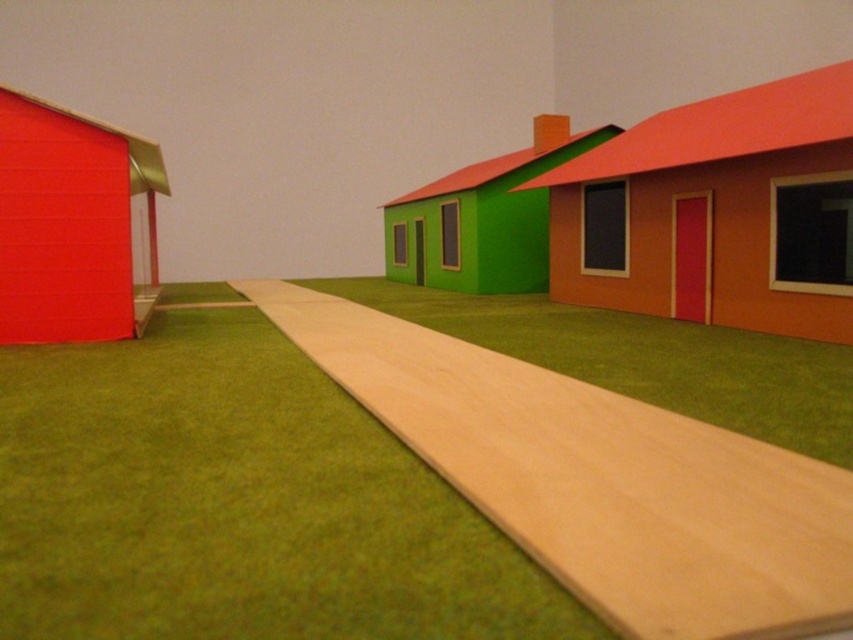
Question: Which is farther from the matte red hut at left?

Choices:
 (A) green matte house at center
 (B) orange matte house at center-right
 (C) smooth wooden path at center

Answer: (A)

Question: Does smooth wooden path at center appear under matte red hut at left?

Choices:
 (A) yes
 (B) no

Answer: (A)

Question: Is smooth wooden path at center thinner than green matte house at center?

Choices:
 (A) yes
 (B) no

Answer: (A)

Question: Which object appears farthest from the camera in this image?

Choices:
 (A) orange matte house at center-right
 (B) green matte house at center
 (C) matte red hut at left
 (D) smooth wooden path at center

Answer: (B)

Question: Based on their relative distances, which object is nearer to the matte red hut at left?

Choices:
 (A) green matte house at center
 (B) orange matte house at center-right

Answer: (B)

Question: Can you confirm if smooth wooden path at center is positioned above orange matte house at center-right?

Choices:
 (A) no
 (B) yes

Answer: (A)